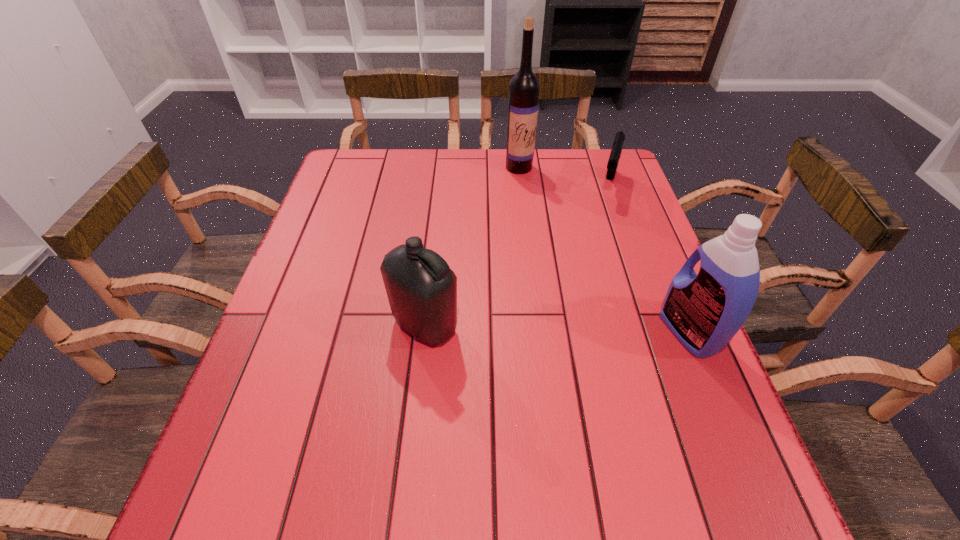
Locate an element on the screen. The width and height of the screenshot is (960, 540). vacant space at the near edge of the desktop is located at coordinates (320, 456).

Identify the location of vacant space at the left edge. (293, 327).

In the image, there is a desktop. Where is `vacant space at the right edge`? The width and height of the screenshot is (960, 540). vacant space at the right edge is located at coordinates (664, 282).

Identify the location of vacant area at the far left corner of the desktop. The width and height of the screenshot is (960, 540). (377, 165).

This screenshot has height=540, width=960. Identify the location of vacant area at the far right corner of the desktop. (595, 167).

You are a GUI agent. You are given a task and a screenshot of the screen. Output one action in this format:
    pyautogui.click(x=<x>, y=<y>)
    Task: Click on the free space between the tallest object and the pistol
    
    Given the screenshot: What is the action you would take?
    pyautogui.click(x=564, y=177)

Find the location of a particular element. This screenshot has height=540, width=960. free spot between the shortest object and the wine bottle is located at coordinates (564, 177).

Where is `free space between the wine bottle and the detergent`? This screenshot has width=960, height=540. free space between the wine bottle and the detergent is located at coordinates (604, 249).

This screenshot has width=960, height=540. Find the location of `unoccupied position between the third tallest object and the pistol`. unoccupied position between the third tallest object and the pistol is located at coordinates (516, 255).

The width and height of the screenshot is (960, 540). I want to click on free area in between the bottle and the shortest object, so click(516, 255).